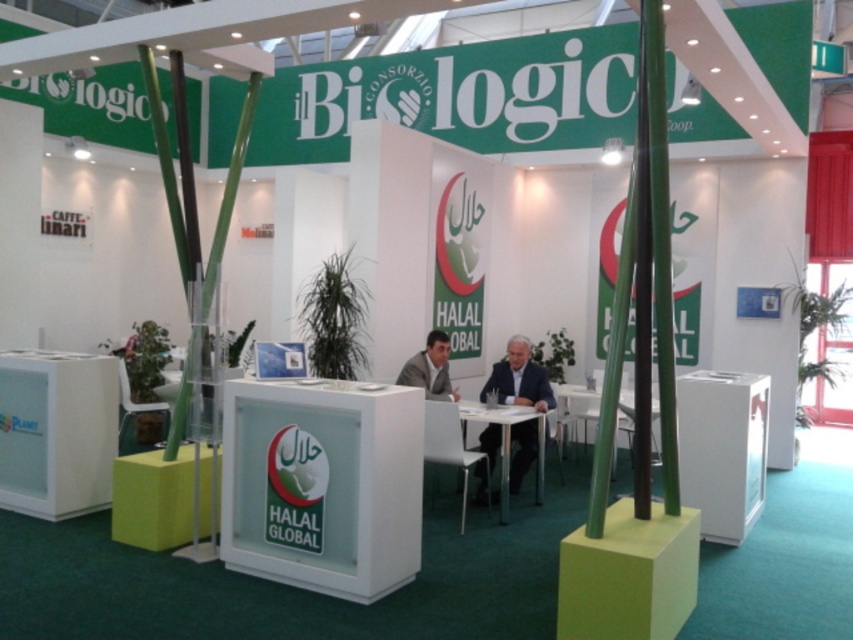
Does point (540, 432) lie in front of point (579, 403)?

That is True.

Can you confirm if white glossy table at center is wider than white plastic table at center?

In fact, white glossy table at center might be narrower than white plastic table at center.

Image resolution: width=853 pixels, height=640 pixels. Find the location of `white glossy table at center`. white glossy table at center is located at coordinates (508, 440).

You are a GUI agent. You are given a task and a screenshot of the screen. Output one action in this format:
    pyautogui.click(x=<x>, y=<y>)
    Task: Click on the white glossy table at center
    The height and width of the screenshot is (640, 853).
    Given the screenshot: What is the action you would take?
    pyautogui.click(x=508, y=440)

Who is more distant from viewer, (515, 342) or (500, 416)?

The point (515, 342) is more distant.

Based on the photo, does dark blue suit at center appear under white glossy table at center?

Actually, dark blue suit at center is above white glossy table at center.

The width and height of the screenshot is (853, 640). What are the coordinates of `dark blue suit at center` in the screenshot? It's located at pyautogui.click(x=519, y=378).

Identify the location of dark blue suit at center. (519, 378).

Is dark blue suit at center to the left of white plastic table at center from the viewer's perspective?

Yes, dark blue suit at center is to the left of white plastic table at center.

Is point (518, 385) positioned after point (654, 401)?

No, (518, 385) is closer to viewer.

Is point (521, 420) more distant than point (596, 404)?

No, it is not.

This screenshot has height=640, width=853. I want to click on dark blue suit at center, so click(519, 378).